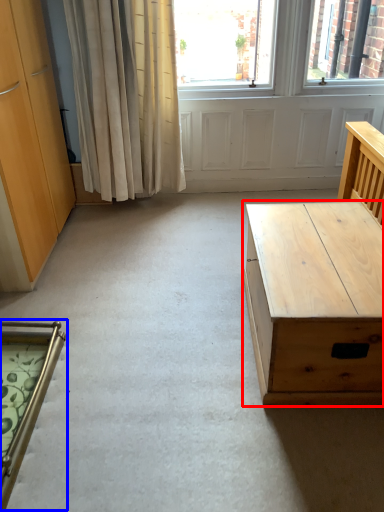
Question: Which of the following is the closest to the observer, desk (highlighted by a red box) or chair (highlighted by a blue box)?

Choices:
 (A) desk
 (B) chair

Answer: (B)